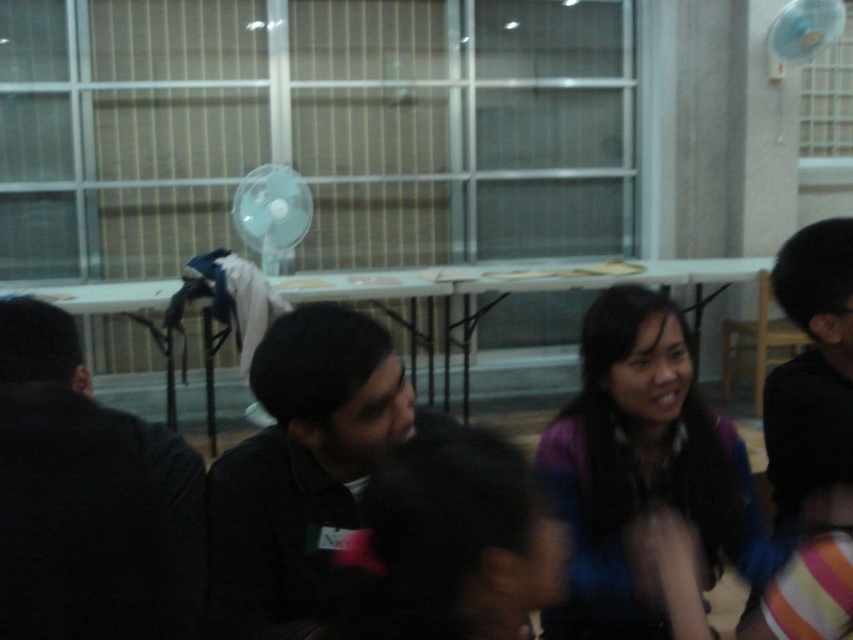
Question: Considering the relative positions of black matte shirt at center and white plastic fan at upper center in the image provided, where is black matte shirt at center located with respect to white plastic fan at upper center?

Choices:
 (A) right
 (B) left

Answer: (A)

Question: Which object is the closest to the black matte shirt at left?

Choices:
 (A) multicolored fabric at center
 (B) white plastic mechanical fan at upper right
 (C) black matte shirt at center

Answer: (C)

Question: Estimate the real-world distances between objects in this image. Which object is farther from the black matte shirt at center?

Choices:
 (A) multicolored fabric at center
 (B) white plastic fan at upper center
 (C) white plastic mechanical fan at upper right

Answer: (C)

Question: Considering the relative positions of black matte shirt at center and white plastic fan at upper center in the image provided, where is black matte shirt at center located with respect to white plastic fan at upper center?

Choices:
 (A) below
 (B) above

Answer: (A)

Question: Estimate the real-world distances between objects in this image. Which object is closer to the multicolored fabric at center?

Choices:
 (A) white plastic fan at upper center
 (B) white plastic mechanical fan at upper right
 (C) black matte shirt at left
 (D) black matte shirt at center

Answer: (D)

Question: Is white plastic fan at upper center smaller than white plastic mechanical fan at upper right?

Choices:
 (A) no
 (B) yes

Answer: (A)